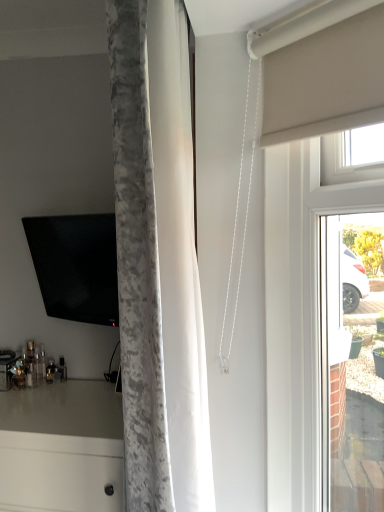
What do you see at coordinates (62, 447) in the screenshot? I see `white glossy countertop at lower left` at bounding box center [62, 447].

You are a GUI agent. You are given a task and a screenshot of the screen. Output one action in this format:
    pyautogui.click(x=<x>, y=<y>)
    Task: Click on the matte black tv at left
    Image resolution: width=384 pixels, height=512 pixels.
    Given the screenshot: What is the action you would take?
    pyautogui.click(x=76, y=266)

This screenshot has height=512, width=384. In the image, there is a white glossy countertop at lower left. Identify the location of glass door above it (from the image's perspective). (308, 214).

Which of these two, white glossy countertop at lower left or matte white glass door at right, is thinner?

Thinner between the two is matte white glass door at right.

Is white glossy countertop at lower left far away from matte white glass door at right?

white glossy countertop at lower left is near matte white glass door at right, not far away.

From the image's perspective, which one is positioned lower, white glossy countertop at lower left or matte white glass door at right?

white glossy countertop at lower left.

In the scene shown: Would you say matte black tv at left is inside or outside matte white glass door at right?

matte black tv at left lies outside matte white glass door at right.

From a real-world perspective, is matte black tv at left beneath matte white glass door at right?

No, from a real-world perspective, matte black tv at left is not beneath matte white glass door at right.

Locate an element on the screen. The height and width of the screenshot is (512, 384). glass door that is below the matte black tv at left (from the image's perspective) is located at coordinates (308, 214).

Is matte black tv at left in front of or behind matte white glass door at right in the image?

matte black tv at left is positioned farther from the viewer than matte white glass door at right.

Choose the correct answer: Is white glossy countertop at lower left inside matte black tv at left or outside it?

white glossy countertop at lower left exists outside the volume of matte black tv at left.

At what (x,y) coordinates should I click in order to perform the action: click on television on the right of white glossy countertop at lower left. Please return your answer as a coordinate pair (x, y). This screenshot has height=512, width=384. Looking at the image, I should click on (76, 266).

From a real-world perspective, is white glossy countertop at lower left beneath matte black tv at left?

Yes, from a real-world perspective, white glossy countertop at lower left is under matte black tv at left.

From the image's perspective, is white glossy countertop at lower left beneath matte black tv at left?

Yes, from the image's perspective, white glossy countertop at lower left is beneath matte black tv at left.

Is matte black tv at left in front of or behind white glossy countertop at lower left in the image?

matte black tv at left is behind white glossy countertop at lower left.

Does point (85, 236) lie behind point (88, 487)?

Yes, it is.

From the image's perspective, which one is positioned higher, matte white glass door at right or matte black tv at left?

From the image's view, matte black tv at left is above.

Is matte white glass door at right located outside matte black tv at left?

matte white glass door at right lies outside matte black tv at left's area.

Which is closer, [289,153] or [87,217]?

Point [289,153] is positioned closer to the camera compared to point [87,217].

Does matte white glass door at right have a larger size compared to matte black tv at left?

Correct, matte white glass door at right is larger in size than matte black tv at left.

Which of these two, matte white glass door at right or white glossy countertop at lower left, is bigger?

white glossy countertop at lower left is bigger.

What's the angular difference between matte white glass door at right and white glossy countertop at lower left's facing directions?

There is a 44.6-degree angle between the facing directions of matte white glass door at right and white glossy countertop at lower left.

Looking at this image, are matte white glass door at right and white glossy countertop at lower left making contact?

No, matte white glass door at right is not beside white glossy countertop at lower left.

From the image's perspective, which one is positioned lower, matte white glass door at right or white glossy countertop at lower left?

white glossy countertop at lower left.

In the image, there is a matte white glass door at right. Identify the location of counter below it (from a real-world perspective). The image size is (384, 512). (62, 447).

Identify the location of glass door located on the right of matte black tv at left. The height and width of the screenshot is (512, 384). (308, 214).

Based on their spatial positions, is matte black tv at left or matte white glass door at right further from white glossy countertop at lower left?

matte white glass door at right.

Considering their positions, is matte black tv at left positioned further to matte white glass door at right than white glossy countertop at lower left?

matte black tv at left is further to matte white glass door at right.

From the image, which object appears to be farther from matte black tv at left, white glossy countertop at lower left or matte white glass door at right?

Among the two, matte white glass door at right is located further to matte black tv at left.

Looking at the image, which one is located further to white glossy countertop at lower left, matte white glass door at right or matte black tv at left?

matte white glass door at right lies further to white glossy countertop at lower left than the other object.

Which object lies further to the anchor point matte white glass door at right, white glossy countertop at lower left or matte black tv at left?

matte black tv at left is further to matte white glass door at right.

From the image, which object appears to be nearer to matte black tv at left, matte white glass door at right or white glossy countertop at lower left?

white glossy countertop at lower left.

Locate an element on the screen. This screenshot has height=512, width=384. television between white glossy countertop at lower left and matte white glass door at right is located at coordinates (76, 266).